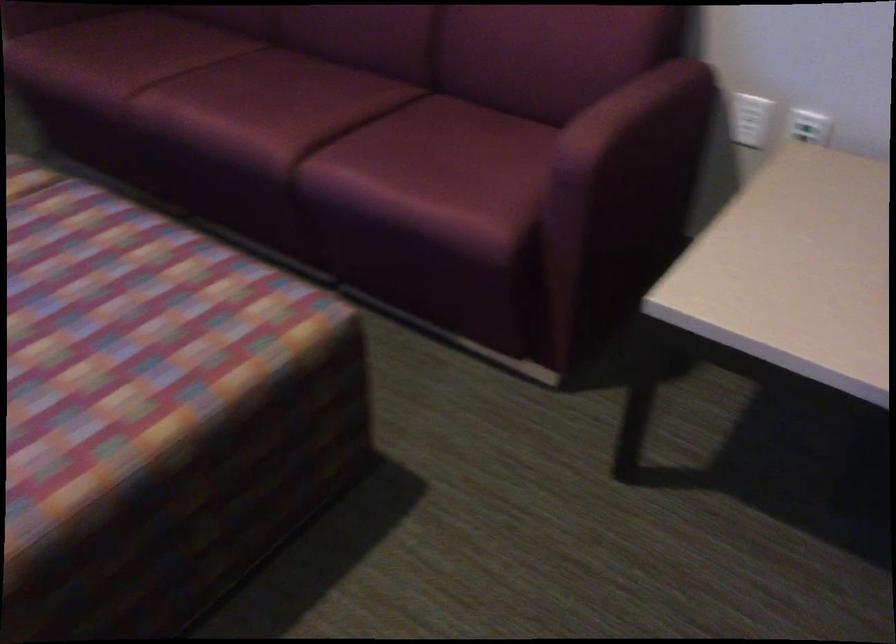
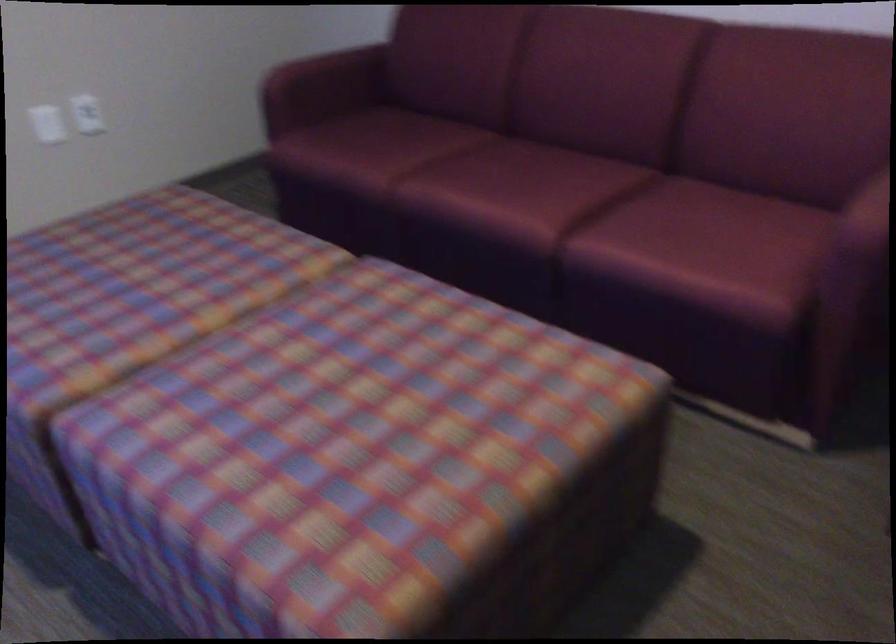
Question: Based on the continuous images, in which direction is the camera rotating? Reply with the corresponding letter.

Choices:
 (A) Left
 (B) Right
 (C) Up
 (D) Down

Answer: (A)